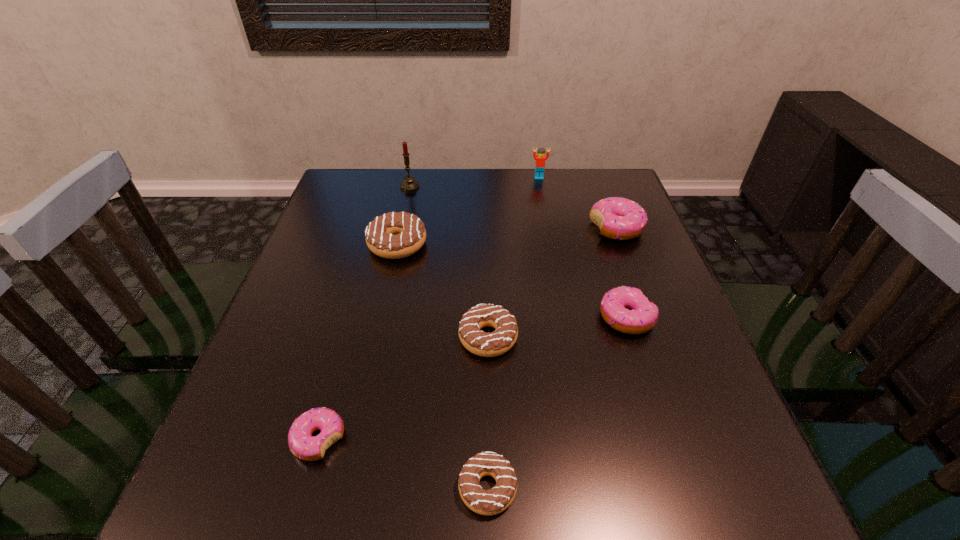
I want to click on free space at the near left corner of the desktop, so click(x=210, y=486).

Locate an element on the screen. This screenshot has width=960, height=540. vacant area that lies between the third object from right to left and the farthest pink doughnut is located at coordinates (578, 202).

Image resolution: width=960 pixels, height=540 pixels. I want to click on vacant area between the third object from right to left and the biggest pink doughnut, so click(578, 202).

At what (x,y) coordinates should I click in order to perform the action: click on unoccupied area between the farthest pink doughnut and the farthest chocolate doughnut. Please return your answer as a coordinate pair (x, y). This screenshot has height=540, width=960. Looking at the image, I should click on (507, 236).

Locate an element on the screen. free space between the biggest pink doughnut and the smallest chocolate doughnut is located at coordinates (552, 357).

At what (x,y) coordinates should I click in order to perform the action: click on free space between the second nearest chocolate doughnut and the red candle. Please return your answer as a coordinate pair (x, y). Looking at the image, I should click on (449, 262).

This screenshot has height=540, width=960. In order to click on free spot between the farthest object and the farthest pink doughnut in this screenshot , I will do `click(578, 202)`.

Where is `empty location between the second farthest chocolate doughnut and the leftmost chocolate doughnut`? This screenshot has width=960, height=540. empty location between the second farthest chocolate doughnut and the leftmost chocolate doughnut is located at coordinates (443, 291).

Find the location of a particular element. object that is the fourth closest one to the second farthest pink doughnut is located at coordinates (394, 235).

At what (x,y) coordinates should I click in order to perform the action: click on object that ranks as the seventh closest to the farthest pink doughnut. Please return your answer as a coordinate pair (x, y). Image resolution: width=960 pixels, height=540 pixels. Looking at the image, I should click on (302, 444).